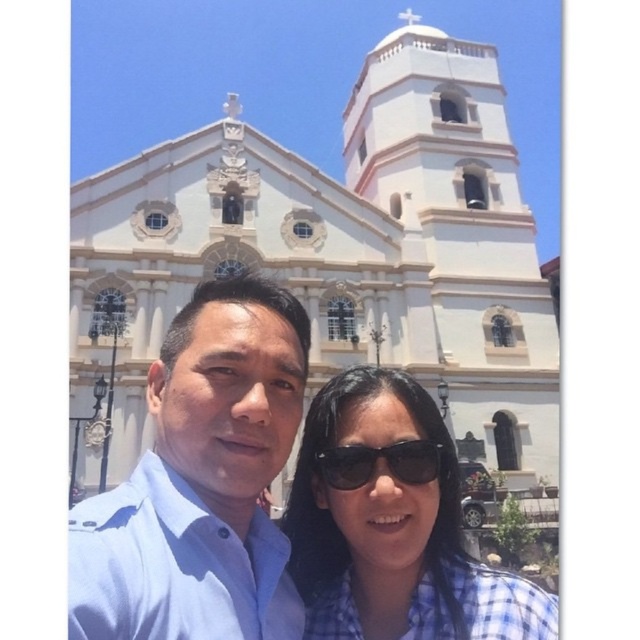
Question: Observing the image, what is the correct spatial positioning of white stone church at center in reference to blue shirt at center?

Choices:
 (A) below
 (B) above

Answer: (B)

Question: Is blue checkered shirt at center positioned at the back of black matte sunglasses at center?

Choices:
 (A) yes
 (B) no

Answer: (B)

Question: Observing the image, what is the correct spatial positioning of blue checkered shirt at center in reference to black matte sunglasses at center?

Choices:
 (A) right
 (B) left

Answer: (A)

Question: Which object is closer to the camera taking this photo?

Choices:
 (A) blue shirt at center
 (B) blue checkered shirt at center
 (C) black matte sunglasses at center

Answer: (A)

Question: Based on their relative distances, which object is farther from the blue checkered shirt at center?

Choices:
 (A) black matte sunglasses at center
 (B) blue shirt at center
 (C) white stone church at center

Answer: (C)

Question: Which of the following is the closest to the observer?

Choices:
 (A) (413, 470)
 (B) (209, 422)
 (C) (396, 621)
 (D) (392, 321)

Answer: (B)